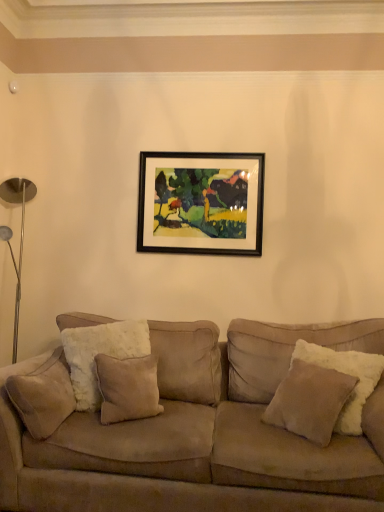
Question: Is black framed painting at upper center not close to suede couch at center?

Choices:
 (A) no
 (B) yes

Answer: (B)

Question: Does black framed painting at upper center come in front of suede couch at center?

Choices:
 (A) no
 (B) yes

Answer: (A)

Question: Is the surface of black framed painting at upper center in direct contact with suede couch at center?

Choices:
 (A) no
 (B) yes

Answer: (A)

Question: Could you tell me if black framed painting at upper center is facing suede couch at center?

Choices:
 (A) no
 (B) yes

Answer: (A)

Question: Considering the relative sizes of black framed painting at upper center and suede couch at center in the image provided, is black framed painting at upper center shorter than suede couch at center?

Choices:
 (A) yes
 (B) no

Answer: (A)

Question: From the image's perspective, is suede couch at center above or below black framed painting at upper center?

Choices:
 (A) below
 (B) above

Answer: (A)

Question: Relative to black framed painting at upper center, is suede couch at center in front or behind?

Choices:
 (A) front
 (B) behind

Answer: (A)

Question: Looking at the image, does suede couch at center seem bigger or smaller compared to black framed painting at upper center?

Choices:
 (A) big
 (B) small

Answer: (A)

Question: Looking at their shapes, would you say suede couch at center is wider or thinner than black framed painting at upper center?

Choices:
 (A) wide
 (B) thin

Answer: (A)

Question: From a real-world perspective, is black framed painting at upper center physically located above or below beige suede pillow at right, the 1th pillow when ordered from right to left?

Choices:
 (A) above
 (B) below

Answer: (A)

Question: Considering the positions of point (233, 238) and point (326, 373), is point (233, 238) closer or farther from the camera than point (326, 373)?

Choices:
 (A) closer
 (B) farther

Answer: (B)

Question: Considering their positions, is black framed painting at upper center located in front of or behind beige suede pillow at right, the 1th pillow when ordered from right to left?

Choices:
 (A) behind
 (B) front

Answer: (A)

Question: In terms of width, does black framed painting at upper center look wider or thinner when compared to beige suede pillow at right, the 2th pillow viewed from the left?

Choices:
 (A) thin
 (B) wide

Answer: (A)

Question: In the image, is suede/velvet pillow at left, placed as the first pillow when sorted from left to right, on the left side or the right side of beige suede pillow at right, the 1th pillow when ordered from right to left?

Choices:
 (A) left
 (B) right

Answer: (A)

Question: Considering the positions of suede/velvet pillow at left, the second pillow when ordered from right to left, and beige suede pillow at right, the 2th pillow viewed from the left, in the image, is suede/velvet pillow at left, the second pillow when ordered from right to left, taller or shorter than beige suede pillow at right, the 2th pillow viewed from the left,?

Choices:
 (A) short
 (B) tall

Answer: (A)